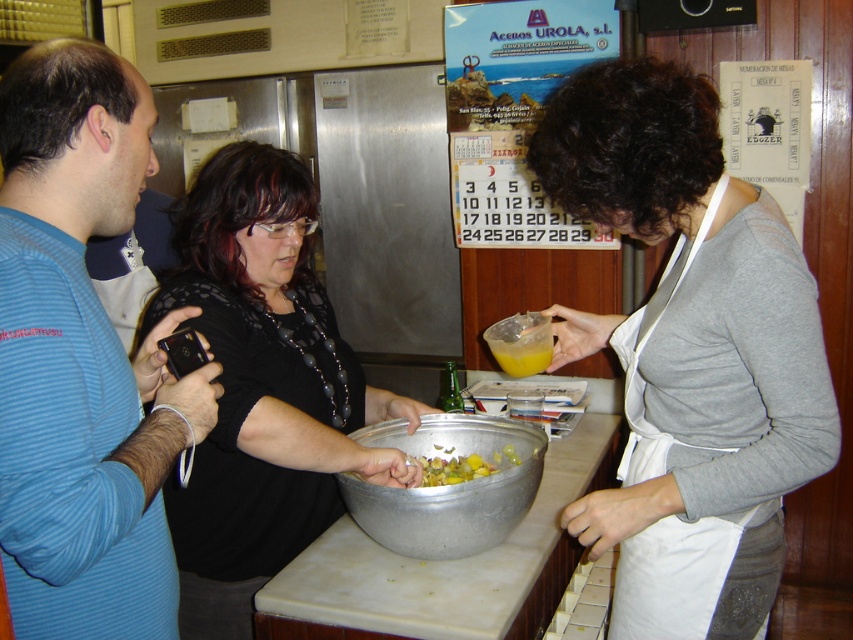
Is point (167, 561) positioned behind point (505, 324)?

No, it is in front of (505, 324).

Does blue striped shirt at left lie behind yellow translucent liquid at center?

No.

Where is `blue striped shirt at left`? blue striped shirt at left is located at coordinates (80, 358).

Which of these two, metallic bowl at center or yellow translucent liquid at center, stands shorter?

With less height is yellow translucent liquid at center.

Is metallic bowl at center bigger than yellow translucent liquid at center?

Correct, metallic bowl at center is larger in size than yellow translucent liquid at center.

Image resolution: width=853 pixels, height=640 pixels. Identify the location of metallic bowl at center. (448, 486).

Is gray matte shirt at center positioned in front of blue striped shirt at left?

No, gray matte shirt at center is further to the viewer.

Does point (770, 516) come behind point (38, 58)?

Yes, point (770, 516) is behind point (38, 58).

Is point (610, 118) positioned behind point (10, 253)?

Yes, it is behind point (10, 253).

The width and height of the screenshot is (853, 640). Identify the location of gray matte shirt at center. (689, 353).